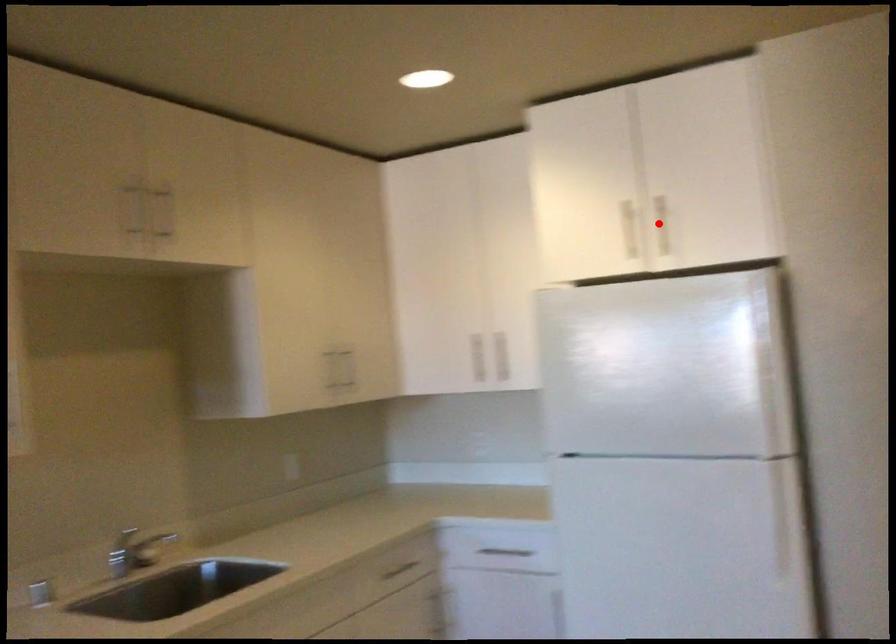
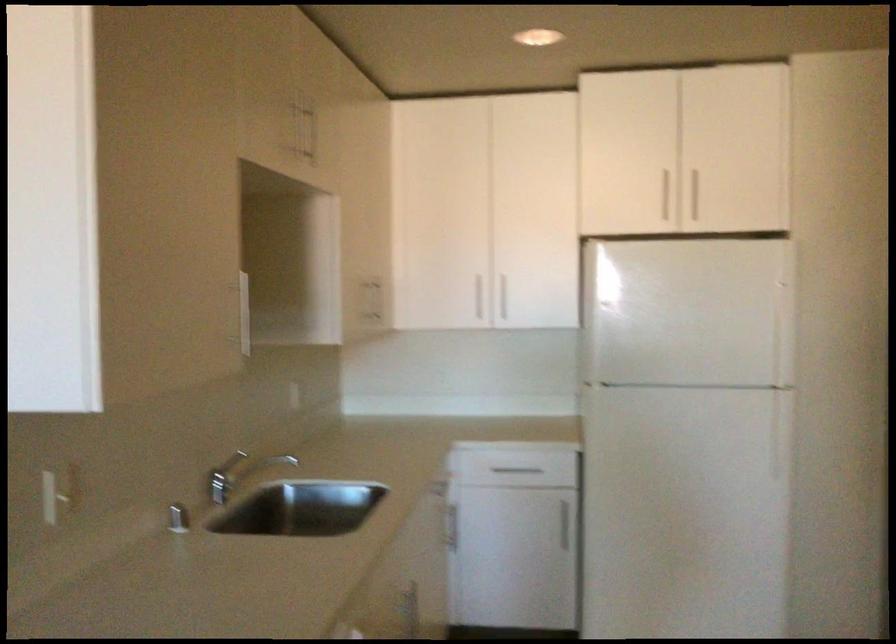
Question: I am providing you with two images of the same scene from different viewpoints. In image1, a red point is highlighted. Considering the same 3D point in image2, which of the following is correct?

Choices:
 (A) It is closer
 (B) It is farther

Answer: (B)